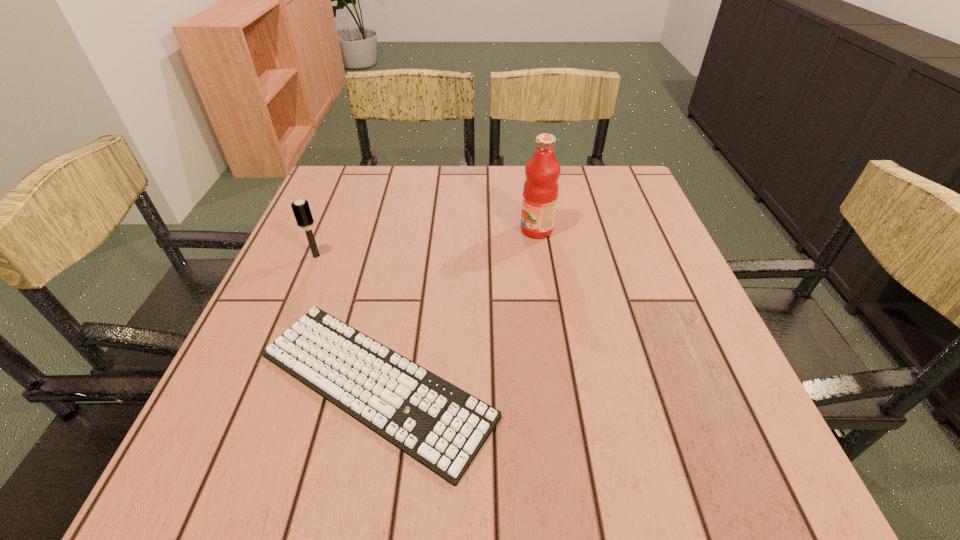
Identify the location of vacant region located on the back of the shortest object. (396, 281).

Where is `object present at the near edge`? Image resolution: width=960 pixels, height=540 pixels. object present at the near edge is located at coordinates (441, 426).

Where is `hairbrush located in the left edge section of the desktop`? This screenshot has height=540, width=960. hairbrush located in the left edge section of the desktop is located at coordinates (301, 209).

The width and height of the screenshot is (960, 540). In order to click on computer keyboard that is positioned at the left edge in this screenshot , I will do `click(441, 426)`.

This screenshot has height=540, width=960. In order to click on object at the near left corner in this screenshot , I will do `click(441, 426)`.

In the image, there is a desktop. Identify the location of vacant region at the far edge. The image size is (960, 540). (518, 172).

In the image, there is a desktop. Where is `vacant space at the near edge`? This screenshot has height=540, width=960. vacant space at the near edge is located at coordinates point(586,454).

This screenshot has height=540, width=960. I want to click on vacant space at the left edge of the desktop, so click(x=338, y=317).

Where is `vacant region at the right edge of the desktop`? vacant region at the right edge of the desktop is located at coordinates (600, 226).

Image resolution: width=960 pixels, height=540 pixels. In the image, there is a desktop. Identify the location of vacant region at the far left corner. point(349,205).